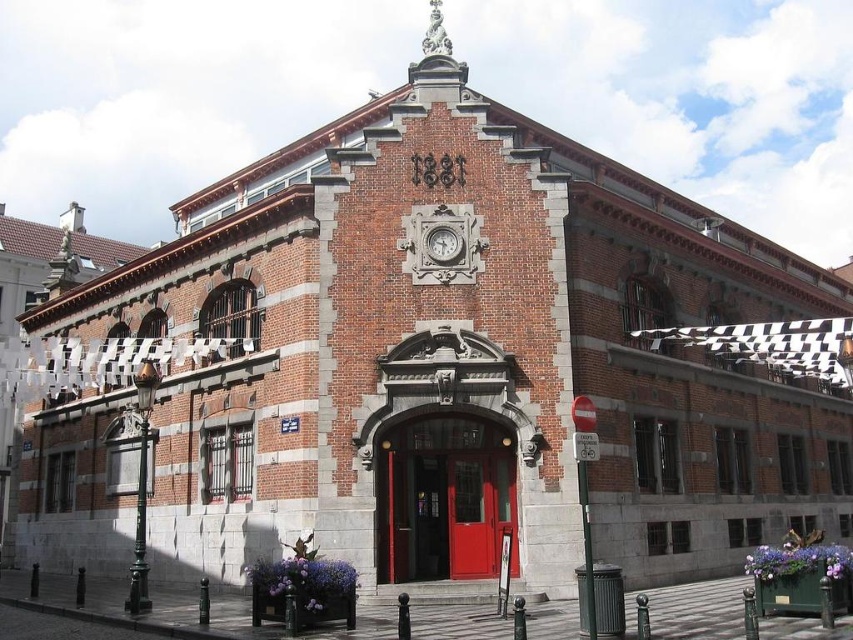
Question: Which object appears farthest from the camera in this image?

Choices:
 (A) smooth red door at center
 (B) matte gray clock at center

Answer: (B)

Question: Is smooth red door at center positioned in front of matte gray clock at center?

Choices:
 (A) yes
 (B) no

Answer: (A)

Question: Is smooth red door at center thinner than matte gray clock at center?

Choices:
 (A) yes
 (B) no

Answer: (B)

Question: Which point appears closest to the camera in this image?

Choices:
 (A) (434, 237)
 (B) (390, 508)

Answer: (B)

Question: Which point is closer to the camera?

Choices:
 (A) matte gray clock at center
 (B) smooth red door at center

Answer: (B)

Question: Does smooth red door at center come in front of matte gray clock at center?

Choices:
 (A) no
 (B) yes

Answer: (B)